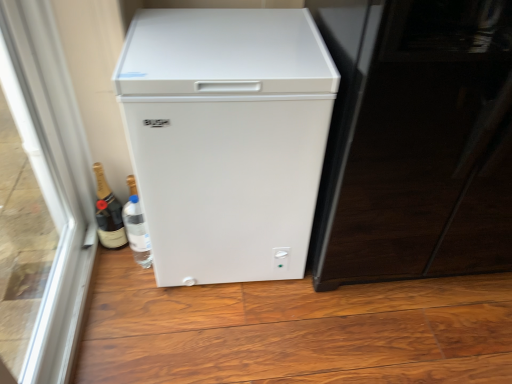
At what (x,y) coordinates should I click in order to perform the action: click on matte gold champagne bottle at lower left. Please return your answer as a coordinate pair (x, y). Looking at the image, I should click on (108, 213).

What do you see at coordinates (108, 213) in the screenshot? I see `matte gold champagne bottle at lower left` at bounding box center [108, 213].

What do you see at coordinates (226, 138) in the screenshot? This screenshot has height=384, width=512. I see `white matte refrigerator at center` at bounding box center [226, 138].

Identify the location of white matte refrigerator at center. The width and height of the screenshot is (512, 384). (226, 138).

The width and height of the screenshot is (512, 384). Identify the location of glossy black screen door at right. (416, 141).

Measure the distance between transparent glass door at left and matte gold champagne bottle at lower left.

transparent glass door at left and matte gold champagne bottle at lower left are 8.57 inches apart from each other.

Is transparent glass door at left inside or outside of matte gold champagne bottle at lower left?

transparent glass door at left is outside matte gold champagne bottle at lower left.

From the image's perspective, which one is positioned higher, transparent glass door at left or matte gold champagne bottle at lower left?

transparent glass door at left is shown above in the image.

Can you confirm if transparent glass door at left is thinner than matte gold champagne bottle at lower left?

Incorrect, the width of transparent glass door at left is not less than that of matte gold champagne bottle at lower left.

Is white matte refrigerator at center turned away from glossy black screen door at right?

No, glossy black screen door at right is not at the back of white matte refrigerator at center.

From the picture: Would you say white matte refrigerator at center is a long distance from glossy black screen door at right?

No, white matte refrigerator at center is in close proximity to glossy black screen door at right.

Identify the location of screen door on the right side of white matte refrigerator at center. (416, 141).

Considering the relative positions of matte gold champagne bottle at lower left and white matte refrigerator at center in the image provided, is matte gold champagne bottle at lower left behind white matte refrigerator at center?

Yes.

Is matte gold champagne bottle at lower left to the right of white matte refrigerator at center from the viewer's perspective?

Answer: No, matte gold champagne bottle at lower left is not to the right of white matte refrigerator at center.

In the image, there is a white matte refrigerator at center. In order to click on bottle below it (from the image's perspective) in this screenshot , I will do `click(108, 213)`.

Is there a large distance between matte gold champagne bottle at lower left and white matte refrigerator at center?

They are positioned close to each other.

Can transparent glass door at left be found inside matte gold champagne bottle at lower left?

No, transparent glass door at left is not a part of matte gold champagne bottle at lower left.

Considering the relative sizes of matte gold champagne bottle at lower left and transparent glass door at left in the image provided, is matte gold champagne bottle at lower left bigger than transparent glass door at left?

No.

How far apart are matte gold champagne bottle at lower left and transparent glass door at left?

They are 8.57 inches apart.

Which is nearer, (103,240) or (27,132)?

Point (103,240).

Considering the positions of objects transparent glass door at left and white matte refrigerator at center in the image provided, who is more to the right, transparent glass door at left or white matte refrigerator at center?

From the viewer's perspective, white matte refrigerator at center appears more on the right side.

From their relative heights in the image, would you say transparent glass door at left is taller or shorter than white matte refrigerator at center?

transparent glass door at left is taller than white matte refrigerator at center.

How much distance is there between glossy black screen door at right and matte gold champagne bottle at lower left?

A distance of 1.03 meters exists between glossy black screen door at right and matte gold champagne bottle at lower left.

The height and width of the screenshot is (384, 512). There is a matte gold champagne bottle at lower left. In order to click on screen door above it (from a real-world perspective) in this screenshot , I will do `click(416, 141)`.

Does point (507, 19) come in front of point (119, 213)?

Yes, point (507, 19) is in front of point (119, 213).

Does glossy black screen door at right have a smaller size compared to matte gold champagne bottle at lower left?

No.

Looking at the image, does glossy black screen door at right seem bigger or smaller compared to white matte refrigerator at center?

Clearly, glossy black screen door at right is larger in size than white matte refrigerator at center.

Can you confirm if glossy black screen door at right is shorter than white matte refrigerator at center?

Incorrect, the height of glossy black screen door at right does not fall short of that of white matte refrigerator at center.

Is white matte refrigerator at center at the back of glossy black screen door at right?

No, glossy black screen door at right's orientation is not away from white matte refrigerator at center.

Identify the location of glass door lying on the left of matte gold champagne bottle at lower left. The image size is (512, 384). (51, 176).

The image size is (512, 384). Identify the location of refrigerator behind the glossy black screen door at right. (226, 138).

Based on their spatial positions, is matte gold champagne bottle at lower left or transparent glass door at left closer to glossy black screen door at right?

Among the two, transparent glass door at left is located nearer to glossy black screen door at right.

When comparing their distances from matte gold champagne bottle at lower left, does transparent glass door at left or white matte refrigerator at center seem closer?

The object closer to matte gold champagne bottle at lower left is transparent glass door at left.

Based on their spatial positions, is white matte refrigerator at center or transparent glass door at left closer to matte gold champagne bottle at lower left?

Among the two, transparent glass door at left is located nearer to matte gold champagne bottle at lower left.

From the image, which object appears to be farther from transparent glass door at left, white matte refrigerator at center or glossy black screen door at right?

glossy black screen door at right lies further to transparent glass door at left than the other object.

From the picture: Which object lies further to the anchor point transparent glass door at left, white matte refrigerator at center or matte gold champagne bottle at lower left?

white matte refrigerator at center is further to transparent glass door at left.

Which object lies further to the anchor point white matte refrigerator at center, matte gold champagne bottle at lower left or glossy black screen door at right?

matte gold champagne bottle at lower left lies further to white matte refrigerator at center than the other object.

Which object lies nearer to the anchor point white matte refrigerator at center, transparent glass door at left or matte gold champagne bottle at lower left?

transparent glass door at left is closer to white matte refrigerator at center.

From the image, which object appears to be farther from glossy black screen door at right, transparent glass door at left or white matte refrigerator at center?

The object further to glossy black screen door at right is transparent glass door at left.

Identify the location of refrigerator between transparent glass door at left and glossy black screen door at right in the horizontal direction. The height and width of the screenshot is (384, 512). (226, 138).

At what (x,y) coordinates should I click in order to perform the action: click on refrigerator between matte gold champagne bottle at lower left and glossy black screen door at right from left to right. Please return your answer as a coordinate pair (x, y). This screenshot has height=384, width=512. Looking at the image, I should click on (226, 138).

I want to click on refrigerator between transparent glass door at left and matte gold champagne bottle at lower left along the z-axis, so click(x=226, y=138).

You are a GUI agent. You are given a task and a screenshot of the screen. Output one action in this format:
    pyautogui.click(x=<x>, y=<y>)
    Task: Click on the bottle between transparent glass door at left and glossy black screen door at right from left to right
    Image resolution: width=512 pixels, height=384 pixels.
    Given the screenshot: What is the action you would take?
    pyautogui.click(x=108, y=213)